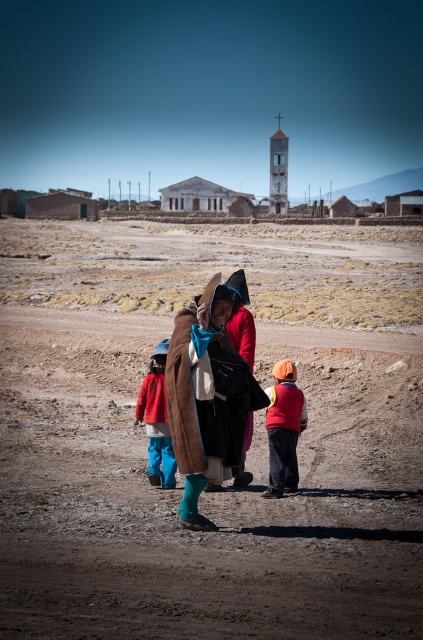
Question: Which point is closer to the camera?

Choices:
 (A) (239, 365)
 (B) (32, 388)

Answer: (A)

Question: Does dull brown dirt field at center have a greater width compared to orange knit hat at center?

Choices:
 (A) yes
 (B) no

Answer: (A)

Question: Estimate the real-world distances between objects in this image. Which object is farther from the brown woolen coat at center?

Choices:
 (A) orange knit hat at center
 (B) matte red jacket at center
 (C) dull brown dirt field at center

Answer: (C)

Question: Does orange knit hat at center appear on the left side of matte red jacket at center?

Choices:
 (A) no
 (B) yes

Answer: (A)

Question: Is brown woolen coat at center closer to the viewer compared to orange knit hat at center?

Choices:
 (A) no
 (B) yes

Answer: (B)

Question: Which of the following is the farthest from the observer?

Choices:
 (A) orange knit hat at center
 (B) brown woolen coat at center
 (C) dull brown dirt field at center
 (D) matte red jacket at center

Answer: (D)